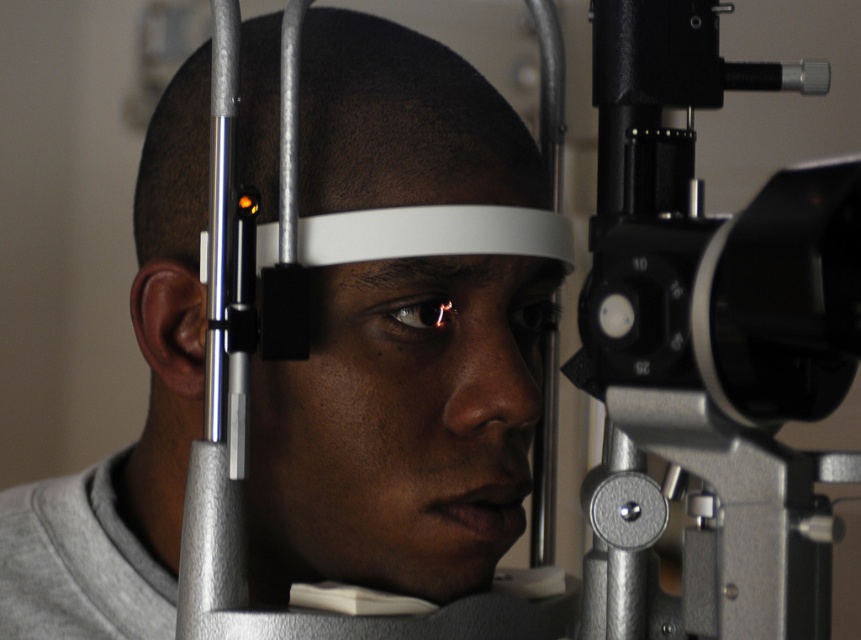
Question: Does matte white forehead at center appear on the right side of matte black eye at center?

Choices:
 (A) yes
 (B) no

Answer: (B)

Question: Among these objects, which one is nearest to the camera?

Choices:
 (A) matte white forehead at center
 (B) matte black eye at center

Answer: (A)

Question: Which point is closer to the camera?

Choices:
 (A) (205, 180)
 (B) (487, 275)

Answer: (B)

Question: Can you confirm if silver metallic telescope at right is smaller than matte black eye at center?

Choices:
 (A) yes
 (B) no

Answer: (B)

Question: Which object appears closest to the camera in this image?

Choices:
 (A) matte black eye at center
 (B) shiny black eye at center

Answer: (B)

Question: Is matte white forehead at center thinner than shiny black eye at center?

Choices:
 (A) yes
 (B) no

Answer: (B)